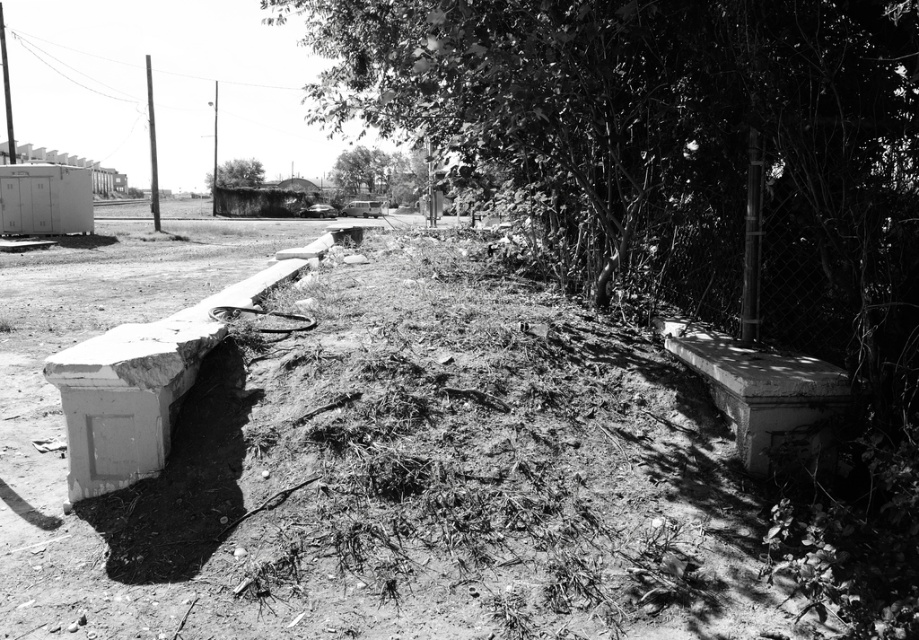
You are standing in the middle of the scene and want to walk towards the two points labeled as point (142,300) and point (827,342). Which point will you reach first?

You will reach point (142,300) first because it is closer to you than point (827,342), which is further away.

You are standing at the point labeled as point (373,460) in the image. What is the immediate surface you are standing on?

The immediate surface at point (373,460) is a dirt field at center.

You are standing in the middle of the scene between the two benches. Looking up, you notice two trees. Which tree, the smooth bark tree at center or the green leafy tree at upper center, is taller?

The smooth bark tree at center is much taller than the green leafy tree at upper center, so the smooth bark tree at center is the taller one.